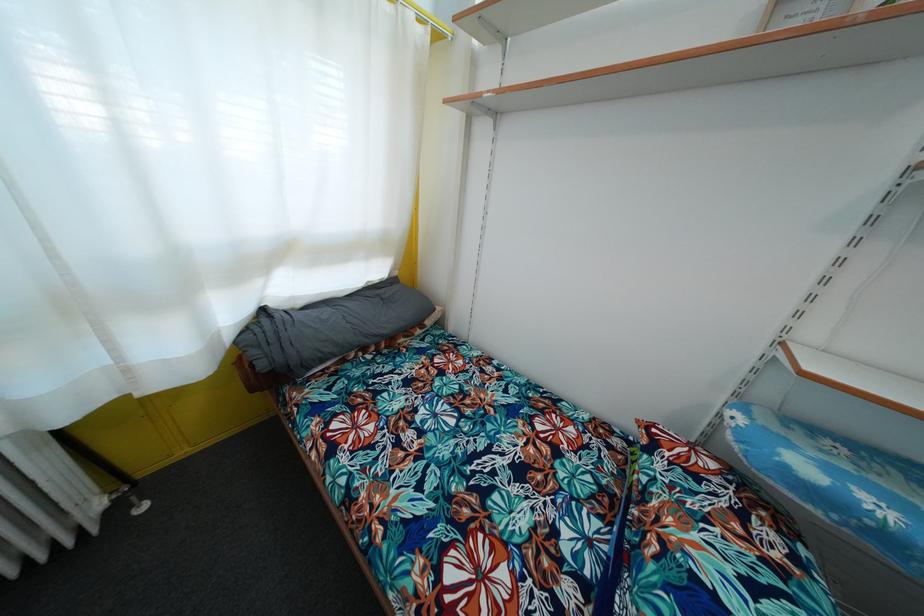
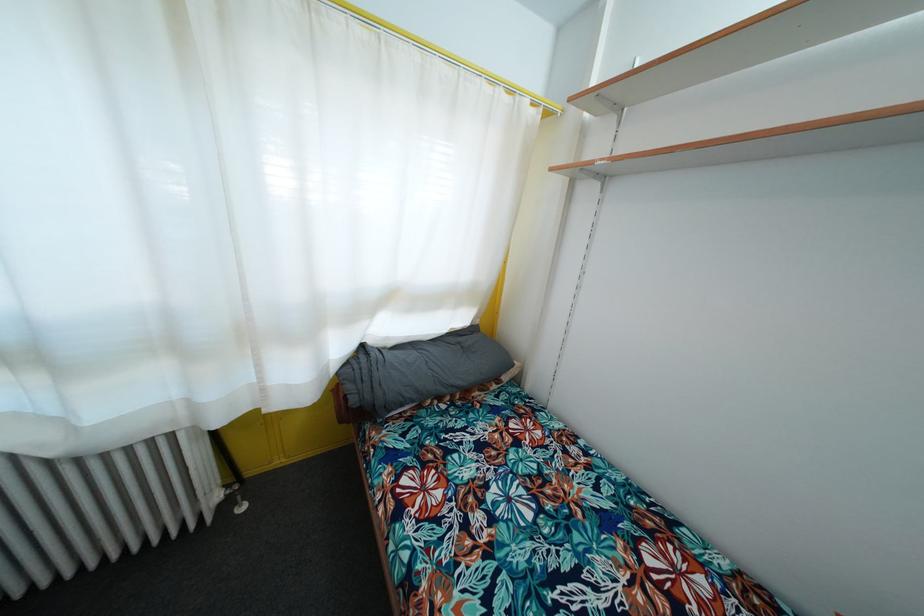
The point at (137,513) is marked in the first image. Where is the corresponding point in the second image?

(240, 511)